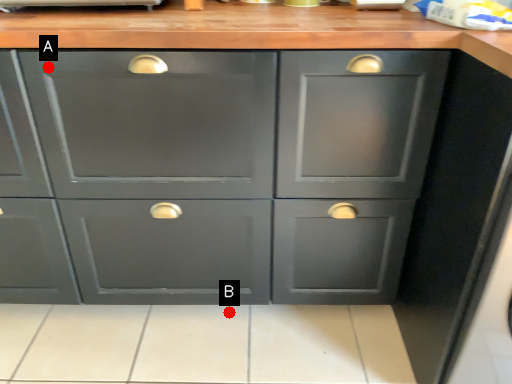
Question: Two points are circled on the image, labeled by A and B beside each circle. Which of the following is the closest to the observer?

Choices:
 (A) A is closer
 (B) B is closer

Answer: (A)